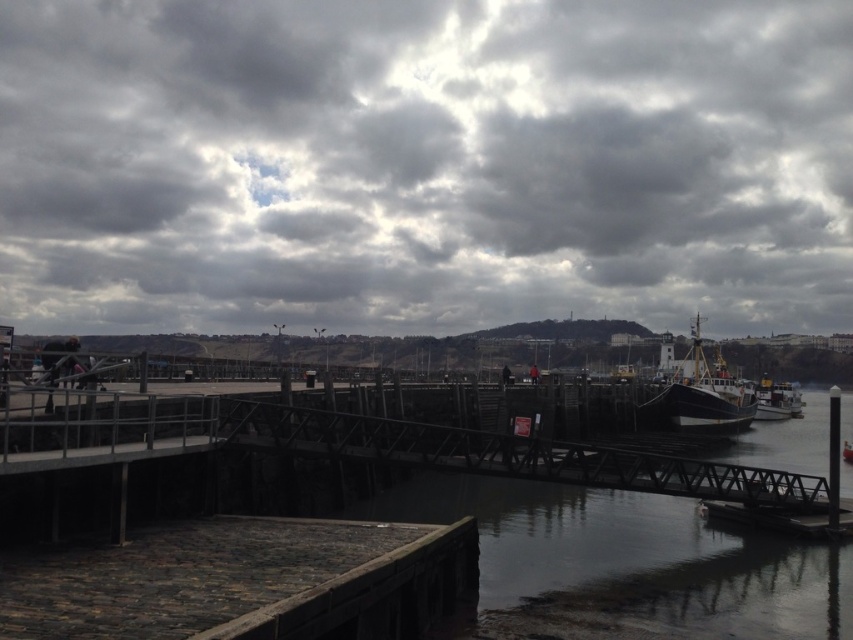
You are standing on the cobblestone walkway leading to the bridge and want to take a photo of the cloudy sky at upper center and the metallic gray bridge at center. Which object should you pan your camera to the left to capture first?

The cloudy sky at upper center is to the left of the metallic gray bridge at center, so you should pan your camera to the left first to capture the cloudy sky at upper center before the bridge.

You are a delivery person carrying a heavy box and need to cross from the stone cobblestone dock at lower left to the metallic gray bridge at center. Can you step directly from the dock to the bridge without needing to adjust your path?

The stone cobblestone dock at lower left is not as tall as the metallic gray bridge at center, so you cannot step directly from the dock to the bridge without needing to adjust your path because there is a height difference between them.

You are standing on the cobblestone walkway in the harbor scene. You see two points marked on the image, point 1 at coordinates (318, 554) and point 2 at coordinates (676, 417). Which point is closer to you, point 1 or point 2?

Point 1 at coordinates (318, 554) is closer to you because it is in front of point 2 at coordinates (676, 417).